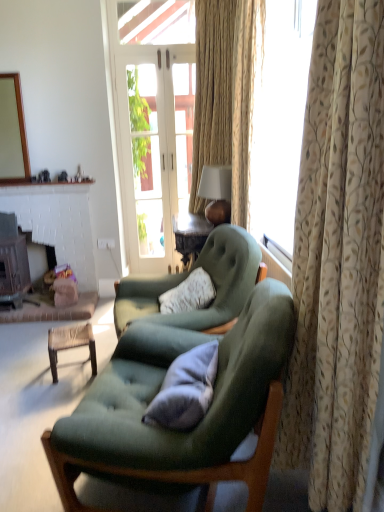
Question: Is dark brown wood fireplace at left, the 2th fireplace viewed from the right, not inside woven brown stool at lower left?

Choices:
 (A) no
 (B) yes

Answer: (B)

Question: From the image's perspective, is dark brown wood fireplace at left, the 1th fireplace from the left, beneath woven brown stool at lower left?

Choices:
 (A) yes
 (B) no

Answer: (B)

Question: Does dark brown wood fireplace at left, the 2th fireplace viewed from the right, appear on the right side of woven brown stool at lower left?

Choices:
 (A) yes
 (B) no

Answer: (B)

Question: Can you confirm if dark brown wood fireplace at left, the 1th fireplace from the left, is shorter than woven brown stool at lower left?

Choices:
 (A) yes
 (B) no

Answer: (B)

Question: From the image's perspective, is dark brown wood fireplace at left, the 1th fireplace from the left, on woven brown stool at lower left?

Choices:
 (A) yes
 (B) no

Answer: (A)

Question: Does point (72, 335) appear closer or farther from the camera than point (97, 243)?

Choices:
 (A) farther
 (B) closer

Answer: (B)

Question: From a real-world perspective, relative to white plastic power outlet at lower center, is woven brown stool at lower left vertically above or below?

Choices:
 (A) below
 (B) above

Answer: (A)

Question: Relative to white plastic power outlet at lower center, is woven brown stool at lower left in front or behind?

Choices:
 (A) behind
 (B) front

Answer: (B)

Question: Based on their sizes in the image, would you say woven brown stool at lower left is bigger or smaller than white plastic power outlet at lower center?

Choices:
 (A) big
 (B) small

Answer: (A)

Question: Visually, is velvet green armchair at center, arranged as the second chair when viewed from the front, positioned to the left or to the right of gray fabric pillow at center?

Choices:
 (A) left
 (B) right

Answer: (A)

Question: From the image's perspective, is velvet green armchair at center, the 1th chair positioned from the back, positioned above or below gray fabric pillow at center?

Choices:
 (A) below
 (B) above

Answer: (B)

Question: In terms of size, does velvet green armchair at center, the 1th chair positioned from the back, appear bigger or smaller than gray fabric pillow at center?

Choices:
 (A) big
 (B) small

Answer: (A)

Question: In terms of height, does velvet green armchair at center, the 1th chair positioned from the back, look taller or shorter compared to gray fabric pillow at center?

Choices:
 (A) tall
 (B) short

Answer: (A)

Question: Considering the positions of point (1, 164) and point (54, 350), is point (1, 164) closer or farther from the camera than point (54, 350)?

Choices:
 (A) farther
 (B) closer

Answer: (A)

Question: Is green matte mirror at upper left inside the boundaries of woven brown stool at lower left, or outside?

Choices:
 (A) outside
 (B) inside

Answer: (A)